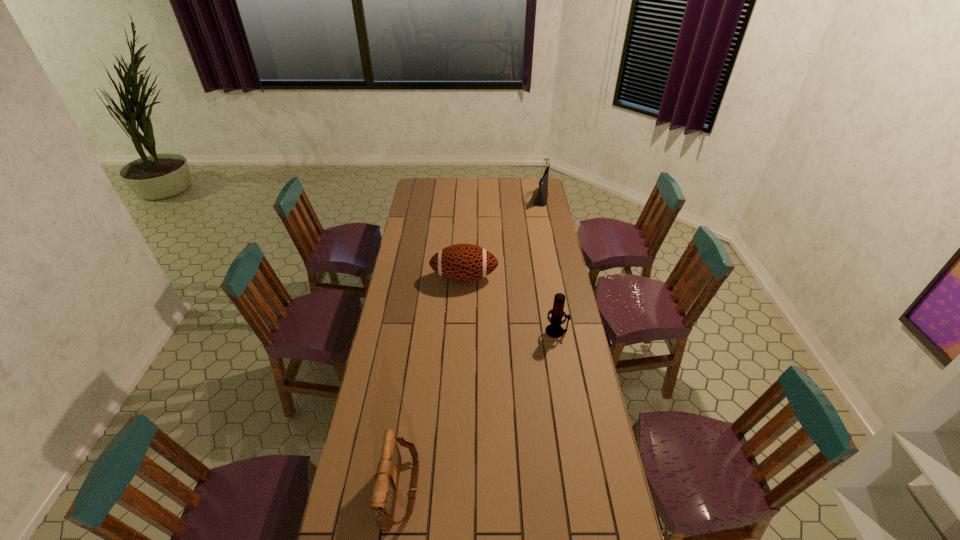
At what (x,y) coordinates should I click in order to perform the action: click on the taller shoulder bag. Please return your answer as a coordinate pair (x, y). Looking at the image, I should click on (540, 200).

The height and width of the screenshot is (540, 960). I want to click on the farther shoulder bag, so click(540, 200).

Find the location of a particular element. Image resolution: width=960 pixels, height=540 pixels. the third farthest object is located at coordinates (554, 330).

Where is `the third nearest object`? The width and height of the screenshot is (960, 540). the third nearest object is located at coordinates (461, 262).

Where is `the left shoulder bag`? The height and width of the screenshot is (540, 960). the left shoulder bag is located at coordinates (384, 494).

Identify the location of the nearer shoulder bag. The height and width of the screenshot is (540, 960). (384, 494).

The width and height of the screenshot is (960, 540). I want to click on vacant space located on the front of the taller shoulder bag, so click(548, 235).

What are the coordinates of `vacant space located 0.120m on the left of the second nearest object` in the screenshot? It's located at (517, 331).

Locate an element on the screen. vacant point located on the front of the football is located at coordinates (464, 302).

Where is `vacant space located 0.150m on the front-facing side of the left shoulder bag`? The height and width of the screenshot is (540, 960). vacant space located 0.150m on the front-facing side of the left shoulder bag is located at coordinates (465, 490).